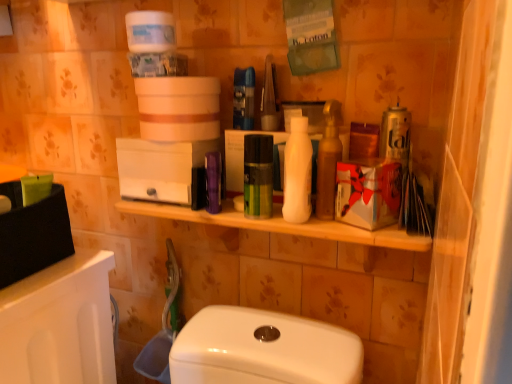
Question: From the image's perspective, is purple plastic container at center, the second toiletry from the right, located beneath shiny brown bottle at center?

Choices:
 (A) yes
 (B) no

Answer: (A)

Question: Does purple plastic container at center, the second toiletry from the right, have a greater height compared to shiny brown bottle at center?

Choices:
 (A) yes
 (B) no

Answer: (B)

Question: Considering the relative sizes of purple plastic container at center, the second toiletry from the right, and shiny brown bottle at center in the image provided, is purple plastic container at center, the second toiletry from the right, wider than shiny brown bottle at center?

Choices:
 (A) yes
 (B) no

Answer: (B)

Question: Is purple plastic container at center, arranged as the first toiletry when viewed from the left, in contact with shiny brown bottle at center?

Choices:
 (A) no
 (B) yes

Answer: (A)

Question: Could you tell me if purple plastic container at center, the second toiletry from the right, is facing shiny brown bottle at center?

Choices:
 (A) no
 (B) yes

Answer: (A)

Question: From their relative heights in the image, would you say white matte bottle at center, which is the 1th toiletry from right to left, is taller or shorter than matte cardboard box at center?

Choices:
 (A) tall
 (B) short

Answer: (A)

Question: Is white matte bottle at center, which is counted as the second toiletry, starting from the left, inside the boundaries of matte cardboard box at center, or outside?

Choices:
 (A) outside
 (B) inside

Answer: (A)

Question: From a real-world perspective, is white matte bottle at center, which is the 1th toiletry from right to left, positioned above or below matte cardboard box at center?

Choices:
 (A) above
 (B) below

Answer: (A)

Question: Relative to matte cardboard box at center, is white matte bottle at center, which is counted as the second toiletry, starting from the left, in front or behind?

Choices:
 (A) front
 (B) behind

Answer: (B)

Question: Looking at their shapes, would you say white matte bottle at center, which is counted as the second toiletry, starting from the left, is wider or thinner than shiny brown bottle at center?

Choices:
 (A) thin
 (B) wide

Answer: (B)

Question: Considering the positions of white matte bottle at center, which is counted as the second toiletry, starting from the left, and shiny brown bottle at center in the image, is white matte bottle at center, which is counted as the second toiletry, starting from the left, taller or shorter than shiny brown bottle at center?

Choices:
 (A) short
 (B) tall

Answer: (A)

Question: Based on their sizes in the image, would you say white matte bottle at center, which is counted as the second toiletry, starting from the left, is bigger or smaller than shiny brown bottle at center?

Choices:
 (A) small
 (B) big

Answer: (B)

Question: Does point pos(297,162) appear closer or farther from the camera than point pos(325,208)?

Choices:
 (A) closer
 (B) farther

Answer: (A)

Question: From the image's perspective, relative to purple plastic container at center, the second toiletry from the right, is shiny brown bottle at center above or below?

Choices:
 (A) above
 (B) below

Answer: (A)

Question: From their relative heights in the image, would you say shiny brown bottle at center is taller or shorter than purple plastic container at center, arranged as the first toiletry when viewed from the left?

Choices:
 (A) tall
 (B) short

Answer: (A)